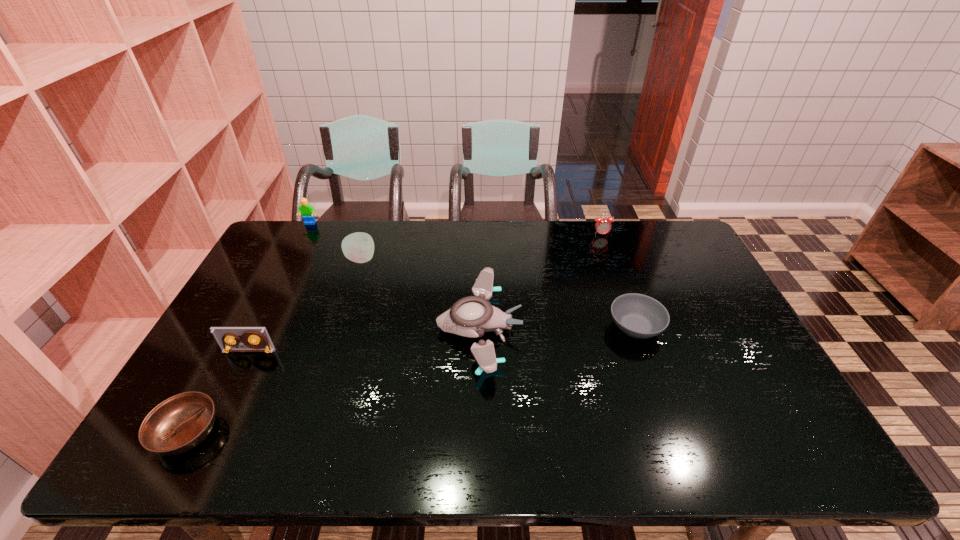
This screenshot has width=960, height=540. What are the coordinates of `Lego that is at the left edge` in the screenshot? It's located at click(x=308, y=213).

Identify the location of videotape situated at the left edge. [253, 339].

You are a GUI agent. You are given a task and a screenshot of the screen. Output one action in this format:
    pyautogui.click(x=<x>, y=<y>)
    Task: Click on the soup bowl situated at the left edge
    
    Given the screenshot: What is the action you would take?
    pyautogui.click(x=178, y=424)

Where is `object located at the far left corner`? This screenshot has height=540, width=960. object located at the far left corner is located at coordinates (308, 213).

This screenshot has width=960, height=540. I want to click on object that is positioned at the near left corner, so click(x=178, y=424).

I want to click on vacant region at the far edge of the desktop, so click(470, 237).

Locate an element on the screen. The height and width of the screenshot is (540, 960). vacant space at the near edge of the desktop is located at coordinates (625, 455).

Where is `free space at the left edge`? The image size is (960, 540). free space at the left edge is located at coordinates point(227,388).

In order to click on free space at the right edge of the desktop in this screenshot , I will do `click(687, 262)`.

Locate an element on the screen. Image resolution: width=960 pixels, height=540 pixels. free location at the far right corner of the desktop is located at coordinates (650, 226).